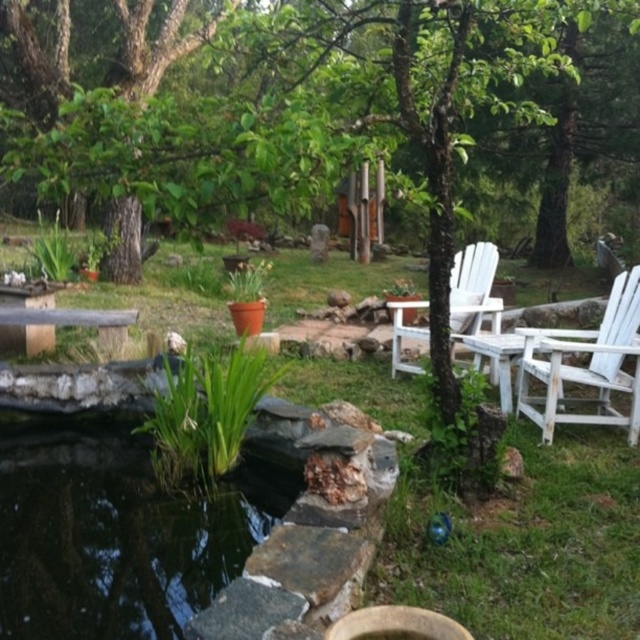
Looking at this image, between green leafy plant at center and white wood chair at center, which one has more height?

white wood chair at center is taller.

Who is positioned more to the left, green leafy plant at center or white wood chair at center?

green leafy plant at center is more to the left.

Between point (280, 509) and point (401, 305), which one is positioned in front?

Point (280, 509) is in front.

The width and height of the screenshot is (640, 640). Identify the location of green leafy plant at center. (116, 532).

Does green leafy plant at center appear on the left side of white wooden chair at right?

Correct, you'll find green leafy plant at center to the left of white wooden chair at right.

Which of these two, green leafy plant at center or white wooden chair at right, stands shorter?

green leafy plant at center

Identify the location of green leafy plant at center. (116, 532).

Is point (529, 348) farther from camera compared to point (406, 330)?

No.

Where is `white wooden chair at right`? Image resolution: width=640 pixels, height=640 pixels. white wooden chair at right is located at coordinates (588, 364).